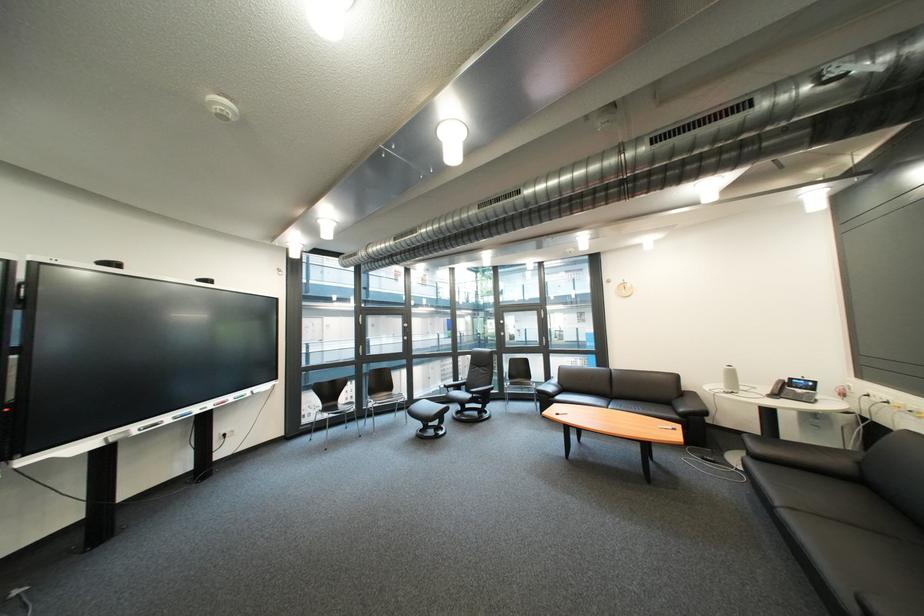
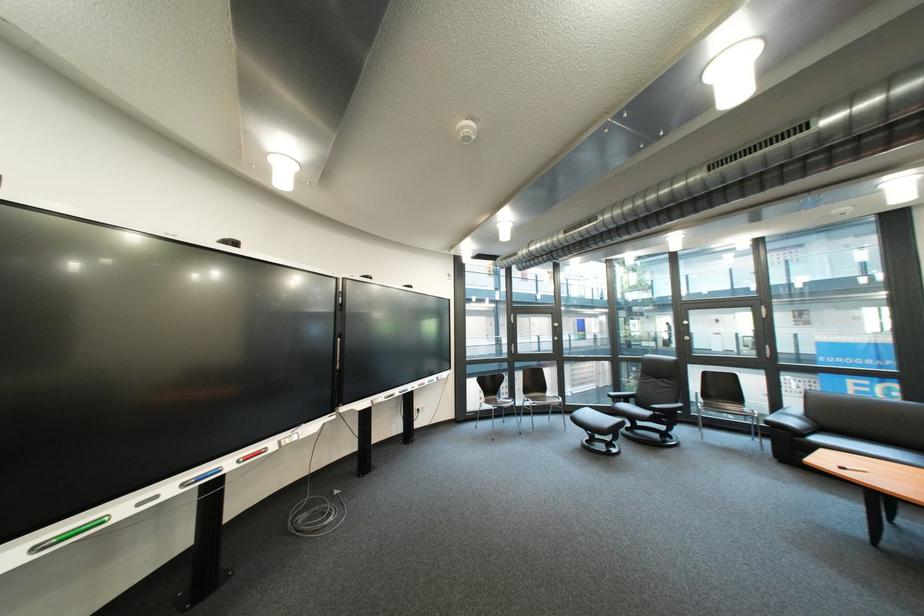
The point at (487, 397) is marked in the first image. Where is the corresponding point in the second image?

(670, 415)